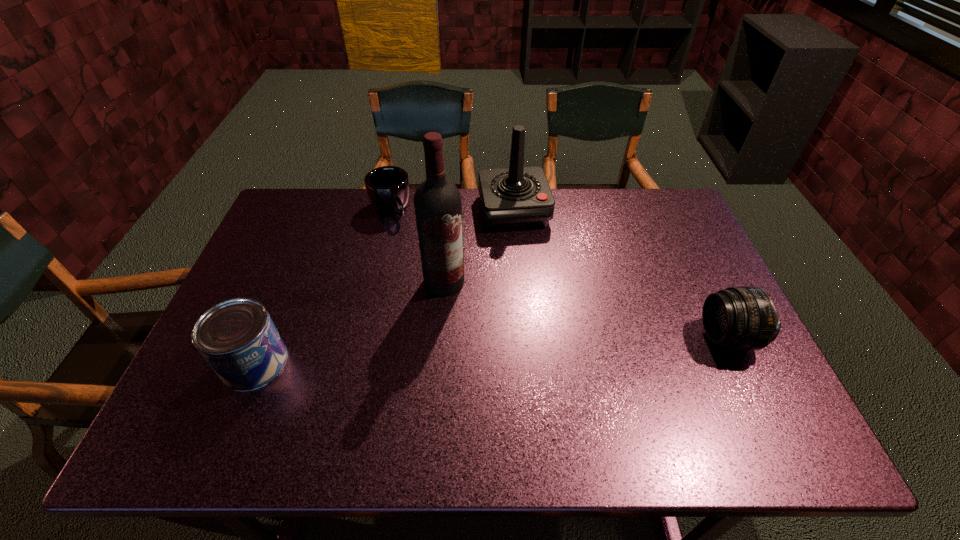
Find the location of a particular element. The width and height of the screenshot is (960, 540). vacant space located at the front element of the telephoto lens is located at coordinates (652, 337).

Locate an element on the screen. This screenshot has height=540, width=960. vacant area situated 0.130m on the label of the tallest object is located at coordinates (441, 335).

The image size is (960, 540). Find the location of `free spot located 0.180m on the label of the tallest object`. free spot located 0.180m on the label of the tallest object is located at coordinates (440, 352).

Find the location of a particular element. vacant area situated on the label of the tallest object is located at coordinates (437, 388).

Where is `free space located 0.340m on the side of the mug with the handle`? The width and height of the screenshot is (960, 540). free space located 0.340m on the side of the mug with the handle is located at coordinates (444, 292).

Locate an element on the screen. blank space located 0.380m on the side of the mug with the handle is located at coordinates (451, 301).

You are a GUI agent. You are given a task and a screenshot of the screen. Output one action in this format:
    pyautogui.click(x=<x>, y=<y>)
    Task: Click on the free point located on the side of the mug with the handle
    The height and width of the screenshot is (540, 960).
    Given the screenshot: What is the action you would take?
    pyautogui.click(x=445, y=294)

The height and width of the screenshot is (540, 960). Find the location of `vacant point located on the front-facing side of the fourth shortest object`. vacant point located on the front-facing side of the fourth shortest object is located at coordinates (537, 300).

The height and width of the screenshot is (540, 960). What are the coordinates of `free space located on the front-facing side of the fourth shortest object` in the screenshot? It's located at (541, 320).

I want to click on vacant position located on the front-facing side of the fourth shortest object, so coord(528,266).